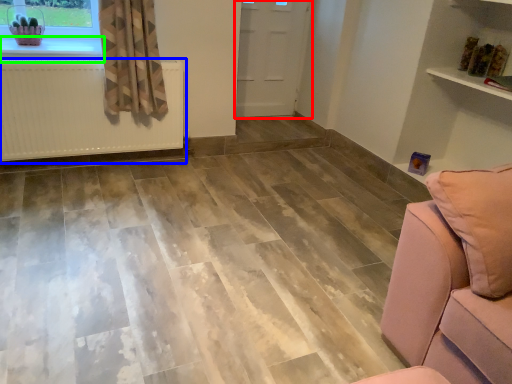
Question: Estimate the real-world distances between objects in this image. Which object is closer to door (highlighted by a red box), radiator (highlighted by a blue box) or window sill (highlighted by a green box)?

Choices:
 (A) radiator
 (B) window sill

Answer: (A)